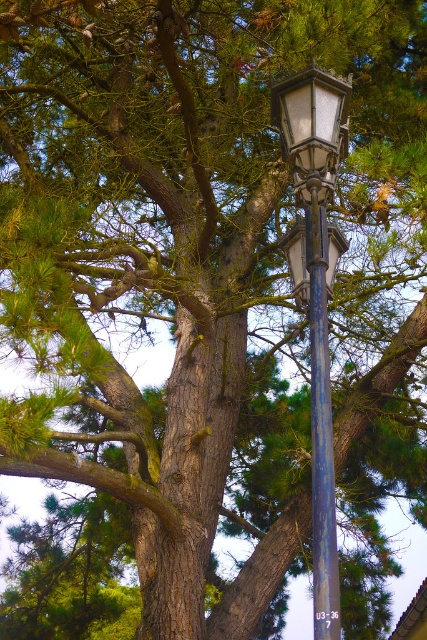
You are standing in front of the tree and see two points marked on the image. The first point is at coordinates point (318, 109) and the second is at point (318, 496). Which of these two points is closer to you?

Point (318, 109) is further to the camera than point (318, 496), so the point closer to you is point (318, 496).